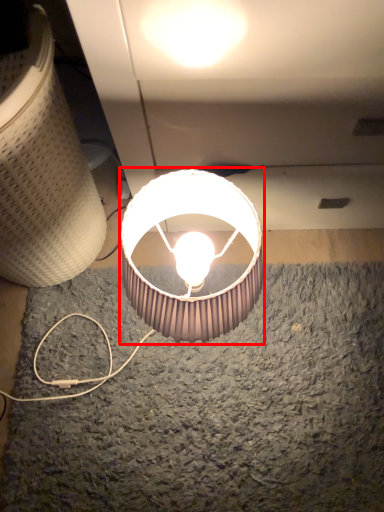
Question: From the image's perspective, considering the relative positions of lamp (annotated by the red box) and lamp in the image provided, where is lamp (annotated by the red box) located with respect to the staircase?

Choices:
 (A) above
 (B) below

Answer: (B)